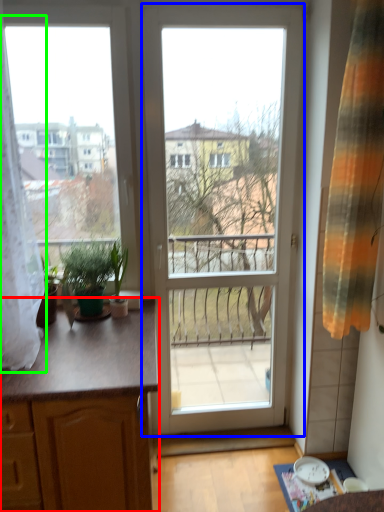
Question: Considering the real-world distances, which object is farthest from cabinetry (highlighted by a red box)? door (highlighted by a blue box) or curtain (highlighted by a green box)?

Choices:
 (A) door
 (B) curtain

Answer: (A)